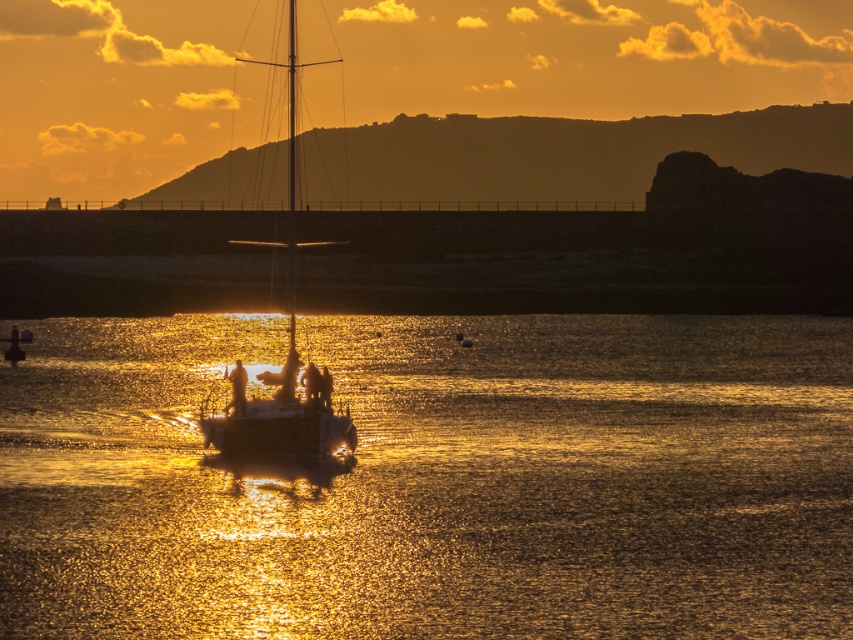
Based on the photo, you are standing on the shore looking at the sunset scene. There is a glistening water at center and a smooth skin person at center. Which object is higher in the image?

The glistening water at center is taller than the smooth skin person at center.

Based on the photo, you are standing at the edge of the water in the sunset scene and see two points marked in the image. Which point, point [339,438] or point [316,397], is closer to you?

Point [339,438] is closer to the viewer than point [316,397].

You are standing at the edge of the water and want to take a photo of both the glistening water at center and the smooth skin person at center. Which object is wider in the frame?

The glistening water at center might be wider than smooth skin person at center.